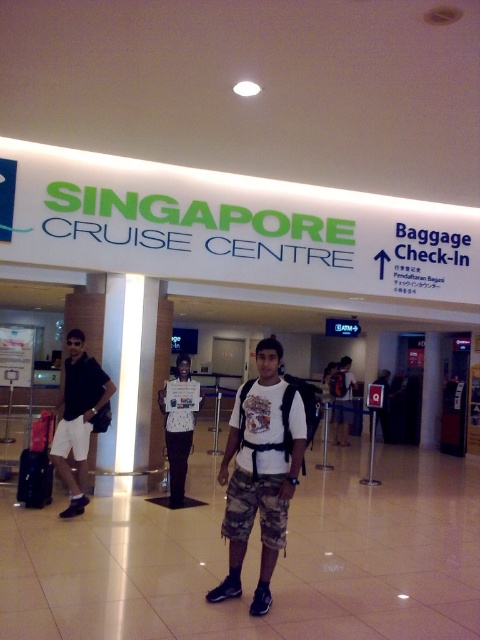
In the scene shown: You are standing at the Singapore Cruise Centre entrance and want to know which point is closer to you between point (180, 497) and point (46, 493). Can you determine which one is nearer?

Point (180, 497) is further to the viewer than point (46, 493), so the point closer to you is point (46, 493).

You are standing at the entrance of the Singapore Cruise Centre and see the matte black shirt at left and the white matte shirt at center. If you need to hand a brochure to both people without moving from your spot, which direction should you face first to ensure you can reach both?

You should face the matte black shirt at left first because it is closer to you than the white matte shirt at center, so you can reach them both by facing the closer one first.